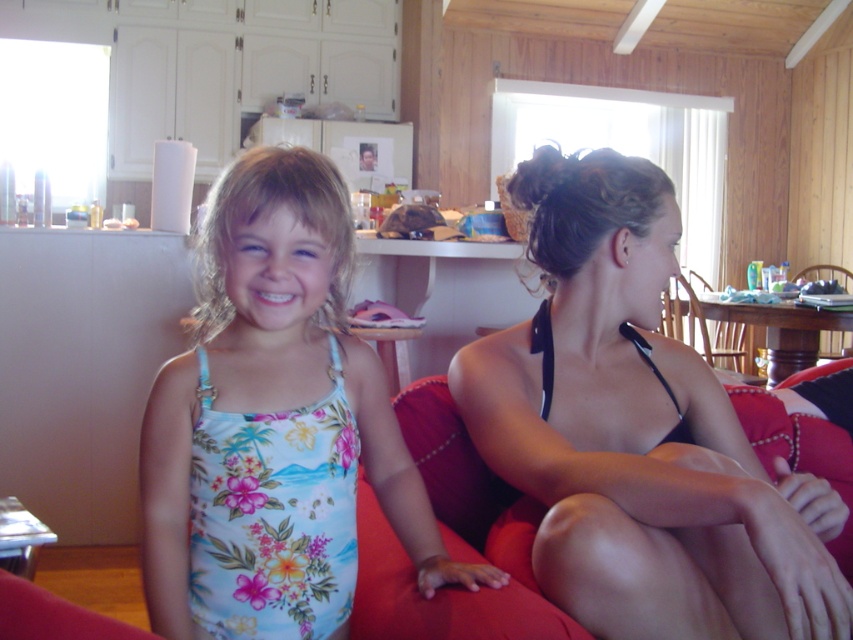
You are standing in the living room and want to place a small plant between the two points marked as point [241,460] and point [486,554]. Which point should the plant be closer to in order to be nearer to the viewer?

The plant should be placed closer to point [241,460] because it is nearer to the viewer compared to point [486,554].